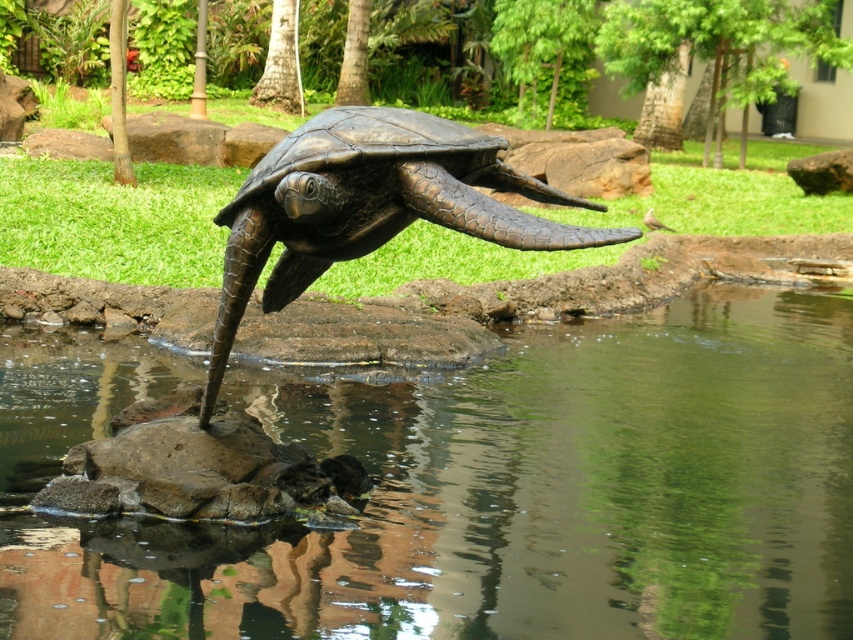
You are standing in the garden looking at the bronze sea turtle sculpture. There are two points marked on the sculpture. The first point is at coordinates point (3, 625) and the second point is at point (289, 214). Which of these two points is closer to you?

Point (3, 625) is in front of point (289, 214), so it is closer to you.

You are a landscape architect designing a new garden. You want to place a decorative stone path between the transparent water at rock center and the bronze textured tortoise at center. Since the path must be narrower than the smaller of the two objects, what is the maximum width the path can be?

The bronze textured tortoise at center is smaller than the transparent water at rock center. Therefore, the path must be narrower than the bronze textured tortoise at center. The maximum width of the path should be just under the width of the bronze textured tortoise at center to ensure it meets the requirement.